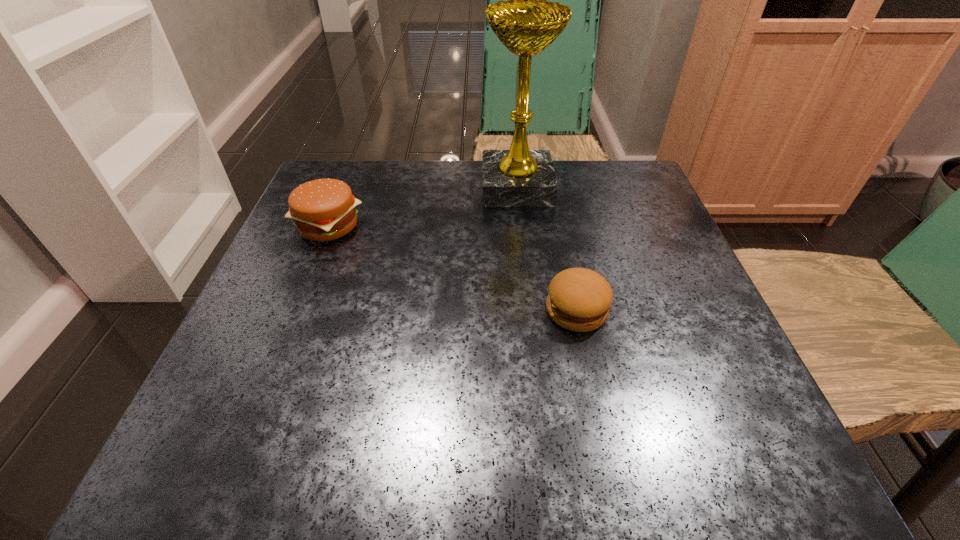
This screenshot has width=960, height=540. Identify the location of award that is at the far edge. (518, 177).

You are a GUI agent. You are given a task and a screenshot of the screen. Output one action in this format:
    pyautogui.click(x=<x>, y=<y>)
    Task: Click on the hamburger at the far edge
    
    Given the screenshot: What is the action you would take?
    pyautogui.click(x=323, y=209)

At what (x,y) coordinates should I click in order to perform the action: click on object located in the left edge section of the desktop. Please return your answer as a coordinate pair (x, y). This screenshot has height=540, width=960. Looking at the image, I should click on (323, 209).

This screenshot has width=960, height=540. In order to click on object located in the far left corner section of the desktop in this screenshot , I will do `click(323, 209)`.

You are a GUI agent. You are given a task and a screenshot of the screen. Output one action in this format:
    pyautogui.click(x=<x>, y=<y>)
    Task: Click on the vacant space at the far edge of the desktop
    
    Given the screenshot: What is the action you would take?
    pyautogui.click(x=565, y=181)

The height and width of the screenshot is (540, 960). Identify the location of vacant space at the near edge of the desktop. (628, 441).

The height and width of the screenshot is (540, 960). I want to click on blank space at the left edge of the desktop, so click(310, 329).

This screenshot has width=960, height=540. What are the coordinates of `free space at the right edge` in the screenshot? It's located at (666, 310).

Identify the location of vacant area at the far right corner. (584, 171).

Where is `vacant point at the near right corner`? vacant point at the near right corner is located at coordinates (674, 442).